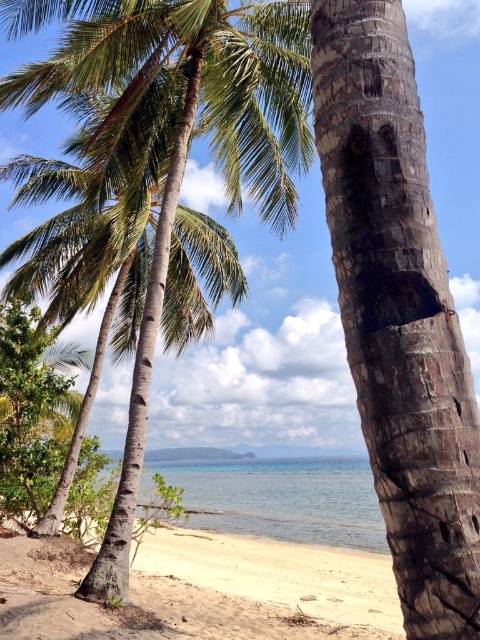
This screenshot has height=640, width=480. Describe the element at coordinates (203, 589) in the screenshot. I see `sandy beach at lower left` at that location.

Does sandy beach at lower left have a greater height compared to clear blue water at center?

Yes, sandy beach at lower left is taller than clear blue water at center.

In order to click on sandy beach at lower left in this screenshot , I will do `click(203, 589)`.

Find the location of a particular element. The width and height of the screenshot is (480, 640). sandy beach at lower left is located at coordinates (203, 589).

Which is above, dark brown textured bark at center or sandy beach at lower left?

dark brown textured bark at center is above.

Can you confirm if dark brown textured bark at center is positioned above sandy beach at lower left?

Yes, dark brown textured bark at center is above sandy beach at lower left.

You are a GUI agent. You are given a task and a screenshot of the screen. Output one action in this format:
    pyautogui.click(x=<x>, y=<y>)
    Task: Click on the dark brown textured bark at center
    
    Given the screenshot: What is the action you would take?
    pyautogui.click(x=398, y=310)

Between dark brown textured bark at center and green leafy coconut tree at left, which one appears on the right side from the viewer's perspective?

dark brown textured bark at center

Is dark brown textured bark at center above green leafy coconut tree at left?

Correct, dark brown textured bark at center is located above green leafy coconut tree at left.

Describe the element at coordinates (398, 310) in the screenshot. I see `dark brown textured bark at center` at that location.

At what (x,y) coordinates should I click in order to perform the action: click on dark brown textured bark at center. Please return your answer as a coordinate pair (x, y). The width and height of the screenshot is (480, 640). Looking at the image, I should click on (398, 310).